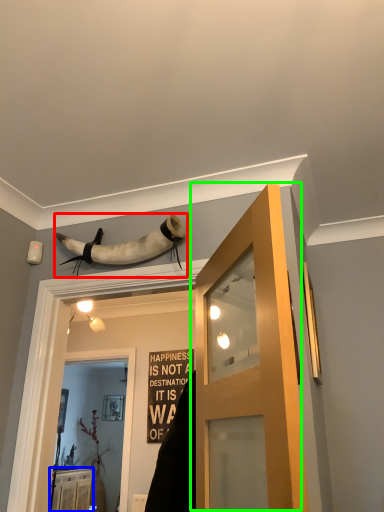
Question: Which is farther away from animal (highlighted by a red box)? cabinetry (highlighted by a blue box) or door (highlighted by a green box)?

Choices:
 (A) cabinetry
 (B) door

Answer: (A)